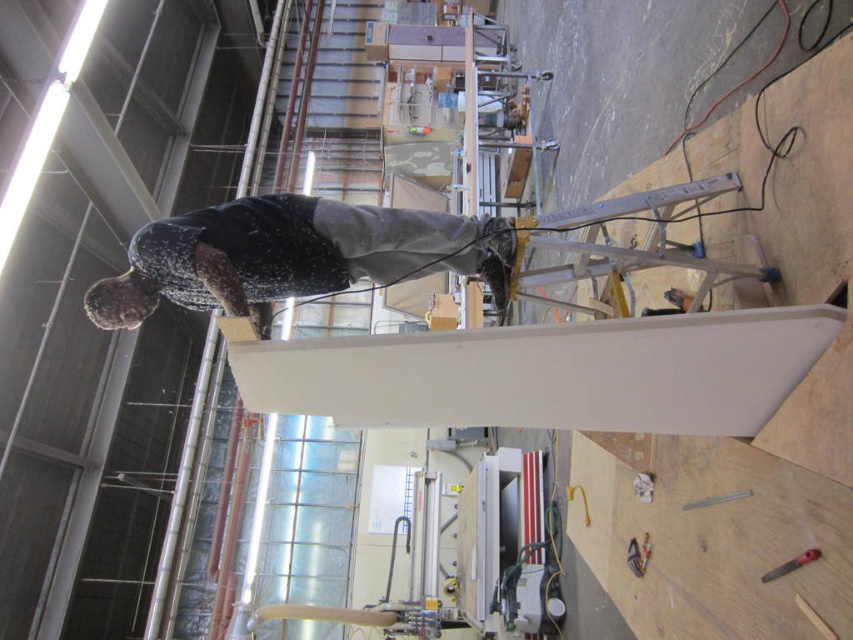
You are a construction worker standing in the workshop and need to position a new tool. Where is the white matte beam at center located in terms of coordinates?

The white matte beam at center is located at coordinates point [549,372].

Looking at this image, you are a construction worker standing at the camera position. You need to reach the white matte beam at center to secure a safety harness. Can you safely reach it without moving your position?

The white matte beam at center is 4.12 feet away from the camera position. Since the average arm length is about 2.5 feet, you cannot safely reach it without moving closer.